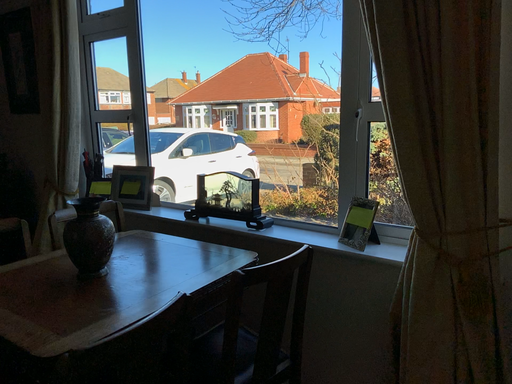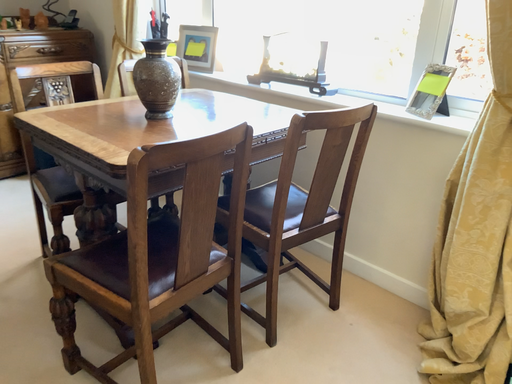
Question: Which way did the camera rotate in the video?

Choices:
 (A) rotated downward
 (B) rotated upward

Answer: (A)